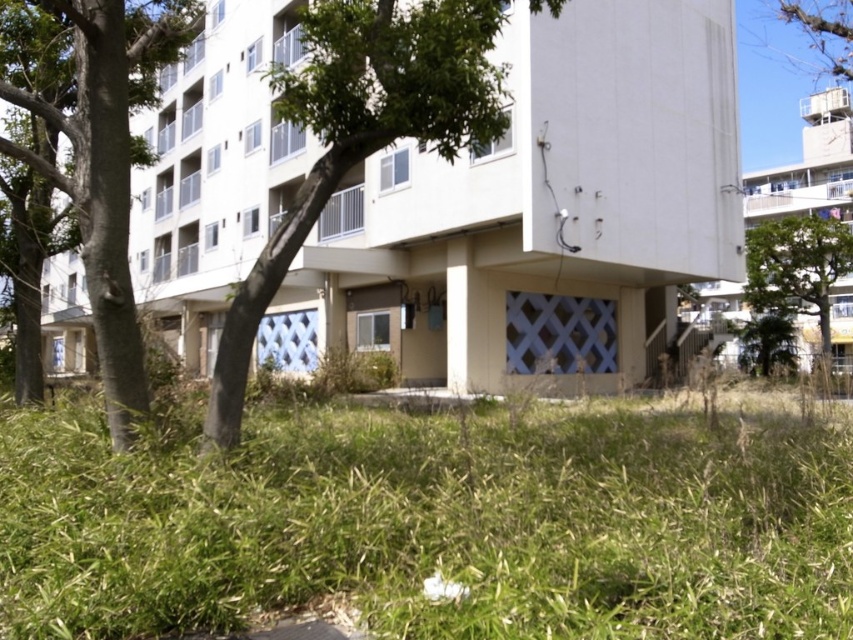
Question: Observing the image, what is the correct spatial positioning of green grass at lower center in reference to green leafy tree at center?

Choices:
 (A) above
 (B) below

Answer: (B)

Question: Can you confirm if green grass at lower center is positioned below green leafy tree at upper right?

Choices:
 (A) no
 (B) yes

Answer: (B)

Question: Which point is closer to the camera?

Choices:
 (A) green leafy tree at upper right
 (B) green leafy tree at center
 (C) green leafy tree at left

Answer: (C)

Question: Which point is farther to the camera?

Choices:
 (A) (311, 92)
 (B) (16, 156)

Answer: (B)

Question: Which object is farther from the camera taking this photo?

Choices:
 (A) green grass at lower center
 (B) green leafy tree at upper right

Answer: (B)

Question: Is green leafy tree at left to the right of green leafy tree at upper right from the viewer's perspective?

Choices:
 (A) no
 (B) yes

Answer: (A)